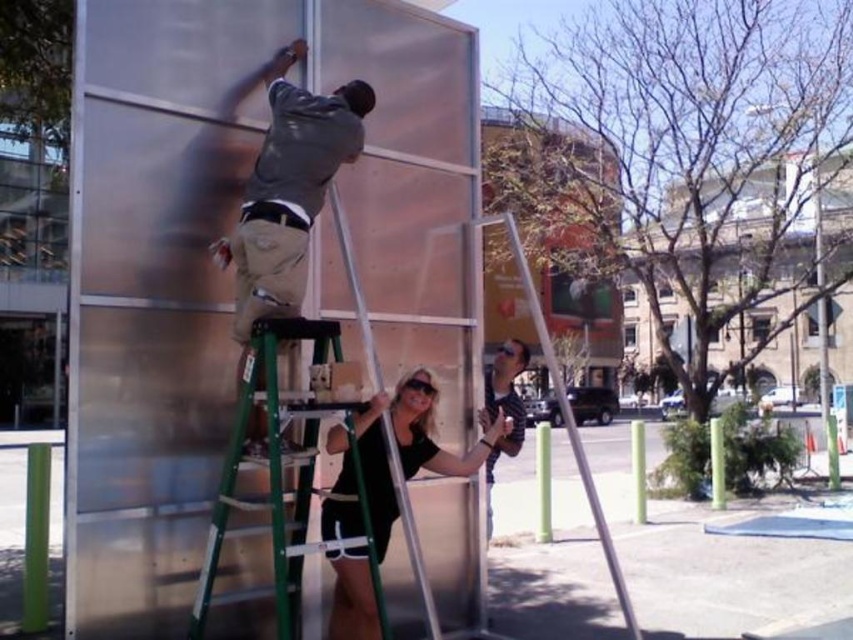
Question: Does green metallic ladder at center have a lesser width compared to black matte dress at center?

Choices:
 (A) no
 (B) yes

Answer: (A)

Question: Which of these objects is positioned closest to the black matte dress at center?

Choices:
 (A) striped shirt at center
 (B) green metallic ladder at center
 (C) matte gray shirt at upper left

Answer: (B)

Question: Can you confirm if green metallic ladder at center is wider than matte gray shirt at upper left?

Choices:
 (A) no
 (B) yes

Answer: (B)

Question: Which object appears closest to the camera in this image?

Choices:
 (A) matte gray shirt at upper left
 (B) black matte dress at center
 (C) green metallic ladder at center

Answer: (C)

Question: Considering the real-world distances, which object is farthest from the matte gray shirt at upper left?

Choices:
 (A) green metallic ladder at center
 (B) black matte dress at center
 (C) striped shirt at center

Answer: (C)

Question: Can you confirm if green metallic ladder at center is positioned above matte gray shirt at upper left?

Choices:
 (A) yes
 (B) no

Answer: (B)